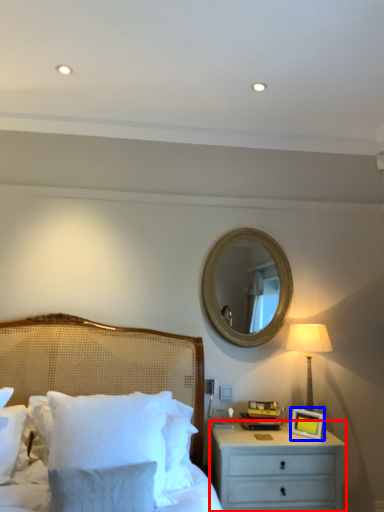
Question: Which point is closer to the camera, nightstand (highlighted by a red box) or picture frame (highlighted by a blue box)?

Choices:
 (A) nightstand
 (B) picture frame

Answer: (A)